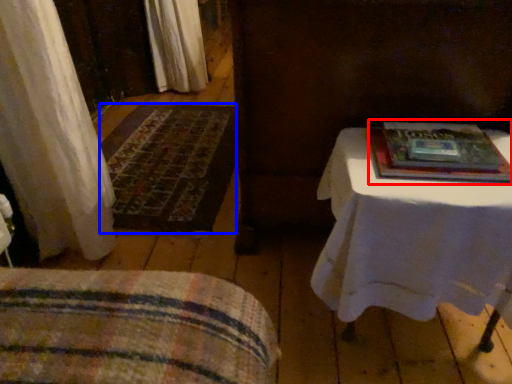
Question: Which of the following is the closest to the observer, paperback book (highlighted by a red box) or mat (highlighted by a blue box)?

Choices:
 (A) paperback book
 (B) mat

Answer: (A)